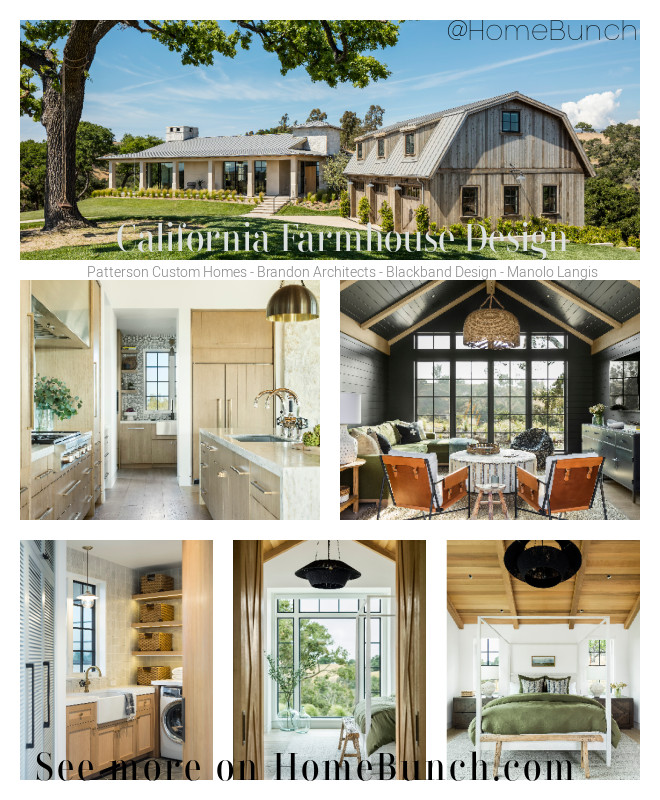
Where is `fridge`? The image size is (660, 800). fridge is located at coordinates click(239, 397), click(210, 397).